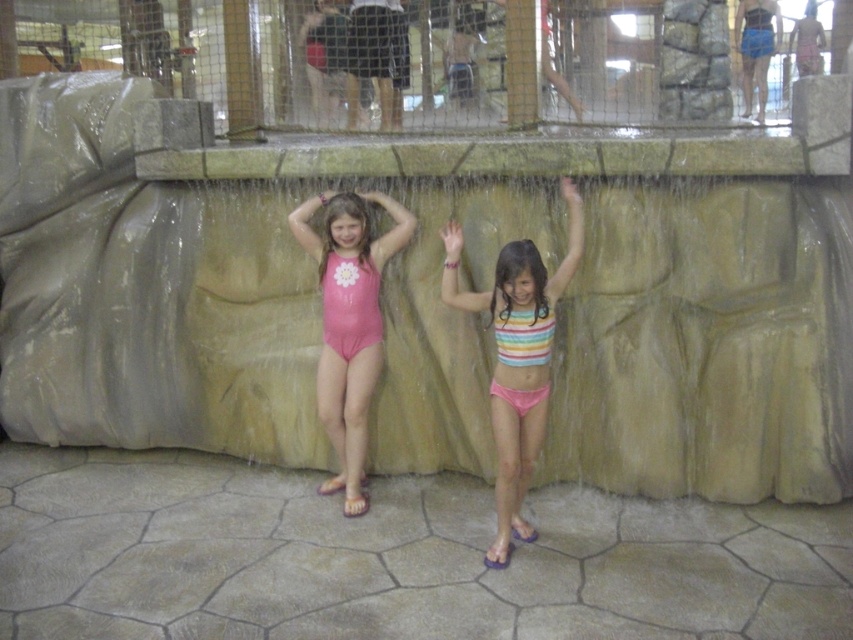
Between point (524, 244) and point (331, 332), which one is positioned in front?

Point (524, 244) is in front.

Where is `rainbow striped bikini top at center`? rainbow striped bikini top at center is located at coordinates (515, 356).

The width and height of the screenshot is (853, 640). Find the location of `rainbow striped bikini top at center`. rainbow striped bikini top at center is located at coordinates (515, 356).